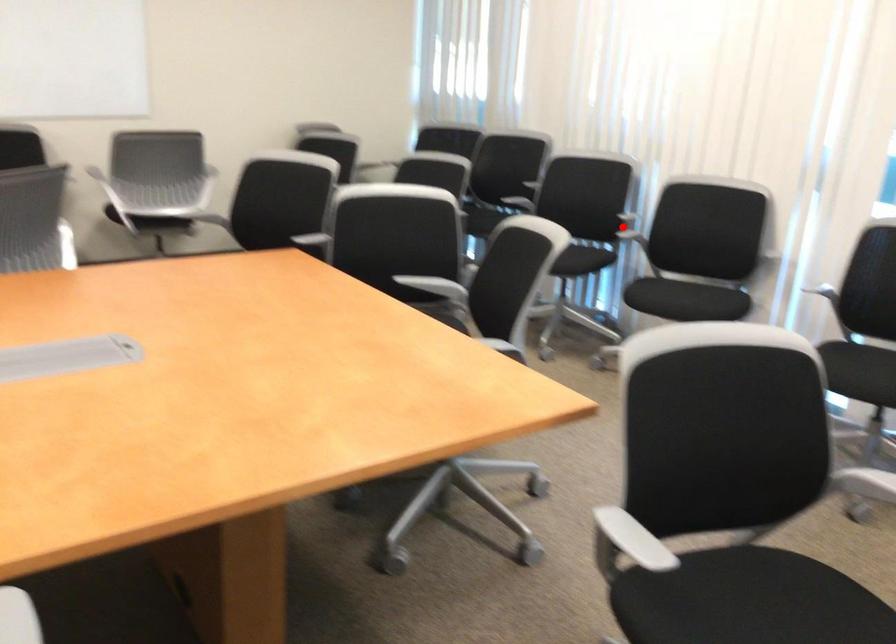
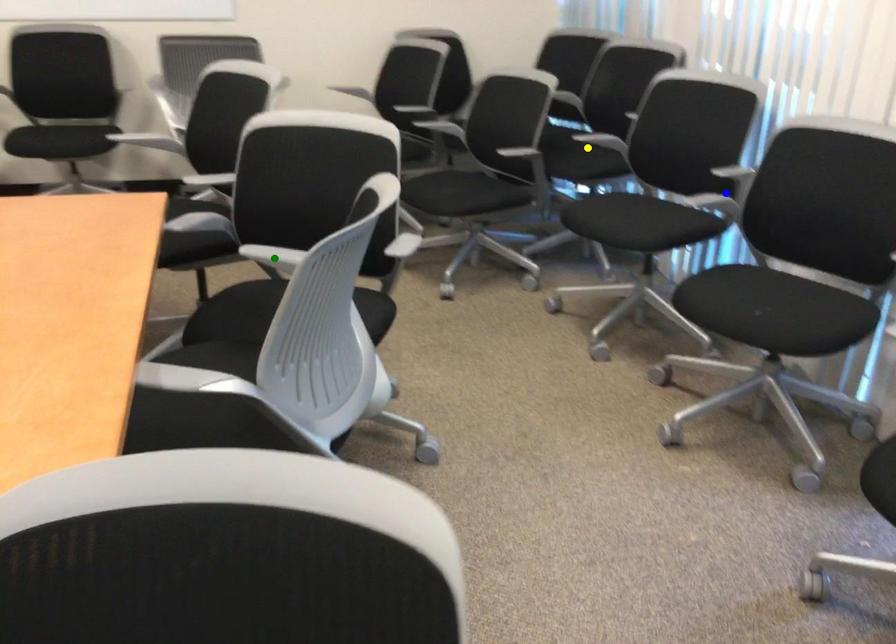
Question: I am providing you with two images of the same scene from different viewpoints. A red point is marked on the first image. You are given multiple points on the second image. Which spot in image 2 lines up with the point in image 1?

Choices:
 (A) yellow point
 (B) green point
 (C) blue point

Answer: (C)